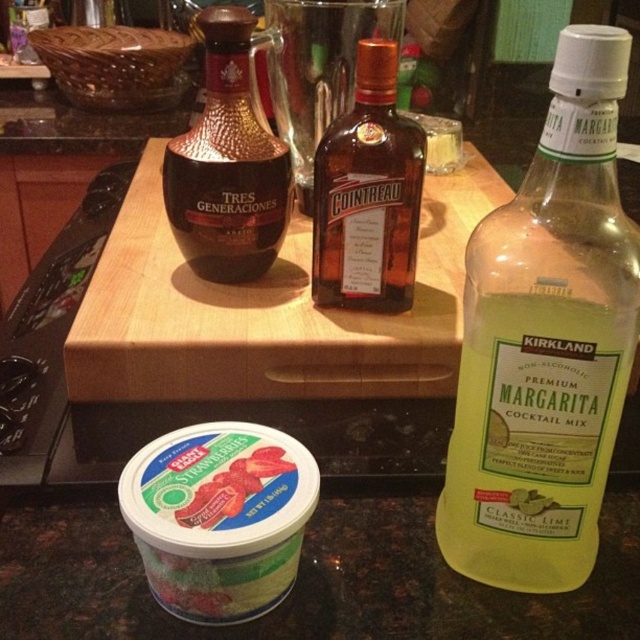
You are a bartender preparing a drink and need to reach for both the brown glass bottle at center and the green matte yogurt at lower left. Which one is closer to your right hand?

The brown glass bottle at center is to the right of green matte yogurt at lower left, so the brown glass bottle at center is closer to your right hand.

You are a bartender preparing a cocktail and need to reach both the strawberries and the cocktail mix. Which of the two points, point (499, 288) or point (260, 136), is closer to you?

Point (499, 288) is closer to the viewer than point (260, 136).